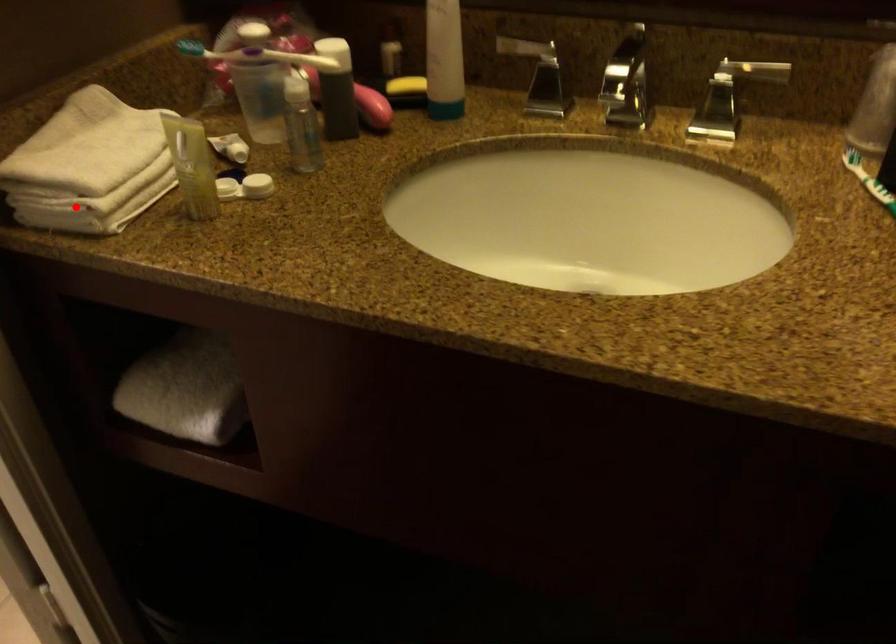
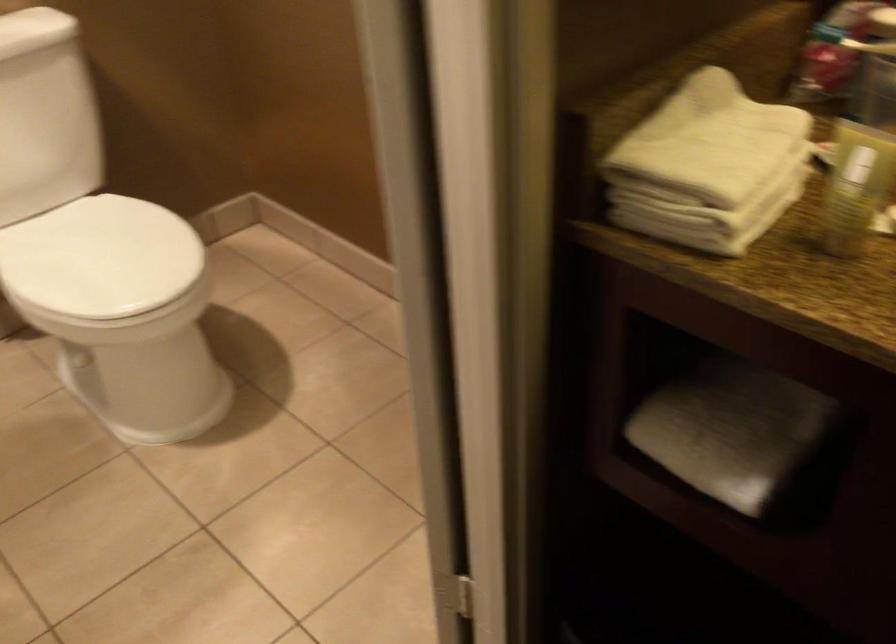
Where in the second image is the point corresponding to the highlighted location from the first image?

(704, 219)